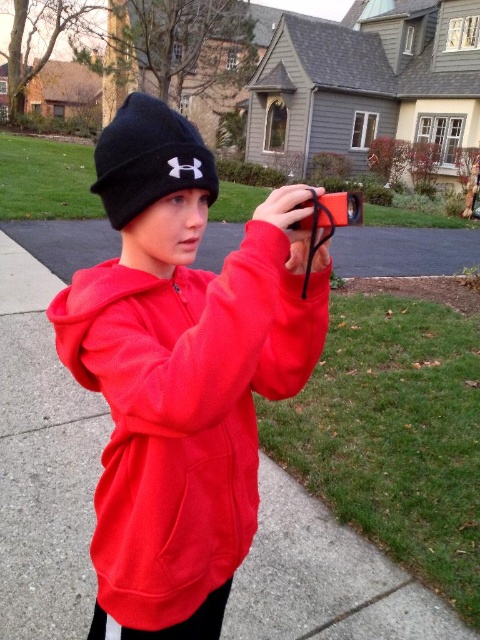
Question: Which object is closer to the camera taking this photo?

Choices:
 (A) black knit beanie at upper center
 (B) matte red hoodie at center

Answer: (B)

Question: Can you confirm if matte red hoodie at center is thinner than black knit beanie at upper center?

Choices:
 (A) no
 (B) yes

Answer: (B)

Question: Which point is farther to the camera?

Choices:
 (A) matte red hoodie at center
 (B) black knit beanie at upper center

Answer: (B)

Question: Can you confirm if matte red hoodie at center is positioned to the right of black knit beanie at upper center?

Choices:
 (A) no
 (B) yes

Answer: (B)

Question: From the image, what is the correct spatial relationship of matte red hoodie at center in relation to black knit beanie at upper center?

Choices:
 (A) right
 (B) left

Answer: (A)